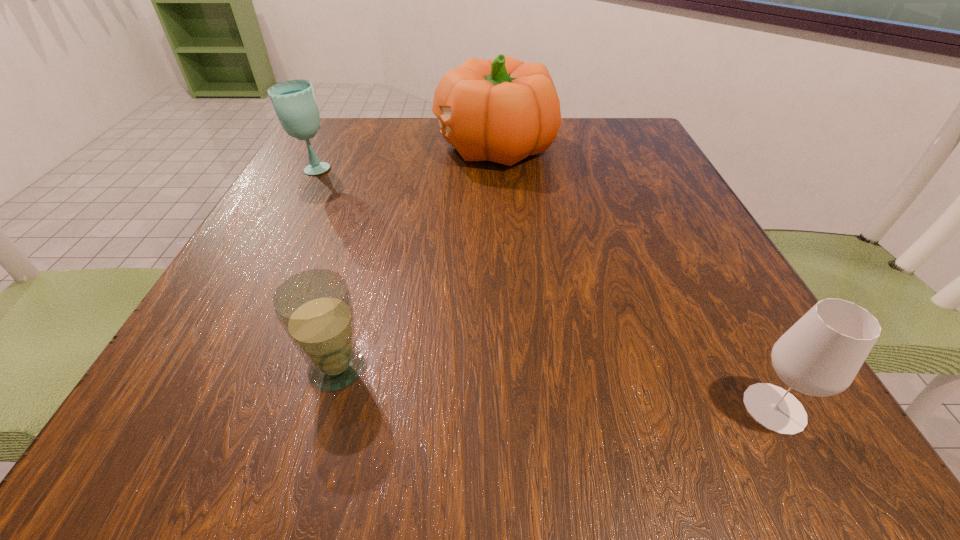
This screenshot has height=540, width=960. I want to click on free space that satisfies the following two spatial constraints: 1. on the back side of the rightmost glass; 2. on the carved face of the pumpkin, so click(x=633, y=146).

Locate an element on the screen. free space that satisfies the following two spatial constraints: 1. on the carved face of the rightmost glass; 2. on the left side of the tallest object is located at coordinates (508, 408).

This screenshot has width=960, height=540. I want to click on blank space that satisfies the following two spatial constraints: 1. on the front side of the second object from left to right; 2. on the right side of the rightmost object, so click(x=326, y=408).

At what (x,y) coordinates should I click in order to perform the action: click on vacant space that satisfies the following two spatial constraints: 1. on the carved face of the rightmost object; 2. on the left side of the pumpkin. Please return your answer as a coordinate pair (x, y). Looking at the image, I should click on (508, 408).

This screenshot has height=540, width=960. What are the coordinates of `vacant space that satisfies the following two spatial constraints: 1. on the carved face of the rightmost object; 2. on the left side of the tallest object` in the screenshot? It's located at (508, 408).

Identify the location of free spot that satisfies the following two spatial constraints: 1. on the carved face of the second object from right to left; 2. on the left side of the rightmost object. (508, 408).

Find the location of `free space that satisfies the following two spatial constraints: 1. on the back side of the rightmost glass; 2. on the carved face of the third object from left to right`. free space that satisfies the following two spatial constraints: 1. on the back side of the rightmost glass; 2. on the carved face of the third object from left to right is located at coordinates (633, 146).

Image resolution: width=960 pixels, height=540 pixels. In order to click on vacant area that satisfies the following two spatial constraints: 1. on the front side of the shortest object; 2. on the left side of the rightmost object in this screenshot , I will do `click(326, 408)`.